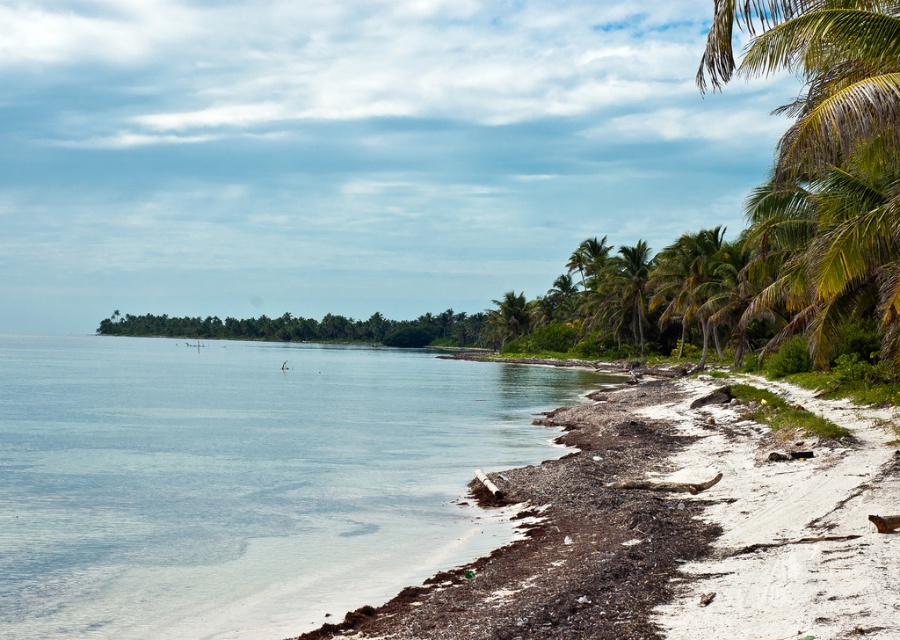
Does brown sand at lower right come behind green leafy palm tree at center-right?

No.

Does brown sand at lower right appear on the left side of green leafy palm tree at center-right?

Indeed, brown sand at lower right is positioned on the left side of green leafy palm tree at center-right.

Locate an element on the screen. The height and width of the screenshot is (640, 900). brown sand at lower right is located at coordinates [677, 528].

Where is `brown sand at lower right`? The height and width of the screenshot is (640, 900). brown sand at lower right is located at coordinates tap(677, 528).

This screenshot has height=640, width=900. What do you see at coordinates (688, 282) in the screenshot? I see `green leafy palm tree at right` at bounding box center [688, 282].

Is point (662, 317) more distant than point (646, 280)?

No, it is in front of (646, 280).

Does point (699, 280) come closer to viewer compared to point (606, 268)?

That is True.

Image resolution: width=900 pixels, height=640 pixels. Identify the location of green leafy palm tree at right. (688, 282).

Who is lower down, clear blue water at lower left or brown sand at lower right?

brown sand at lower right

Does clear blue water at lower left have a larger size compared to brown sand at lower right?

Indeed, clear blue water at lower left has a larger size compared to brown sand at lower right.

Find the location of `clear blue water at lower left`. clear blue water at lower left is located at coordinates (244, 477).